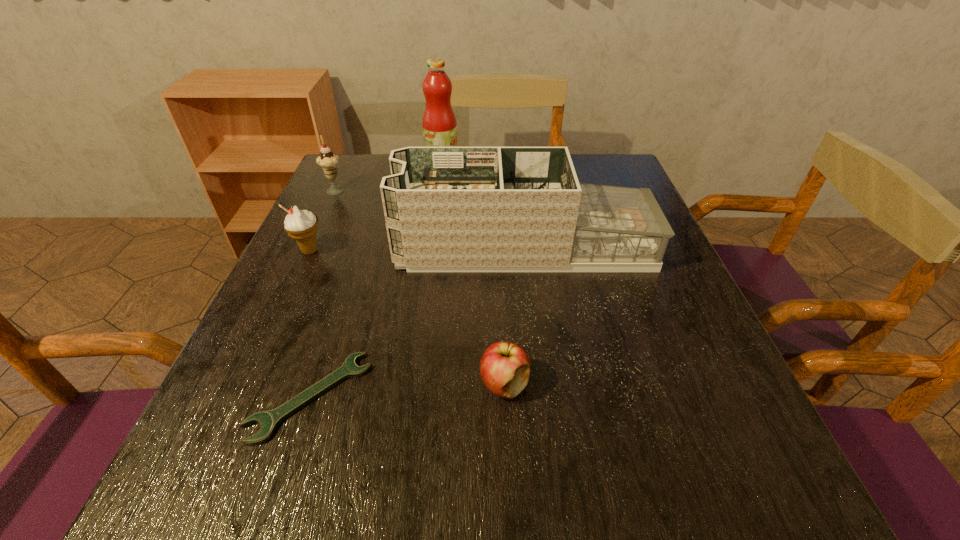
Find the location of `the farthest object`. the farthest object is located at coordinates (439, 123).

Locate an element on the screen. Image resolution: width=960 pixels, height=540 pixels. the tallest object is located at coordinates (439, 123).

Locate an element on the screen. the second tallest object is located at coordinates (447, 209).

Locate an element on the screen. This screenshot has width=960, height=540. the second farthest object is located at coordinates (327, 160).

What are the coordinates of `the farther icecream` in the screenshot? It's located at (327, 160).

At what (x,y) coordinates should I click in order to perform the action: click on the shorter icecream. Please return your answer as a coordinate pair (x, y). Image resolution: width=960 pixels, height=540 pixels. Looking at the image, I should click on (301, 225).

Image resolution: width=960 pixels, height=540 pixels. Find the location of `the third shortest object`. the third shortest object is located at coordinates (301, 225).

Identify the location of apple. (504, 367).

At what (x,y) coordinates should I click in order to perform the action: click on the shortest object. Please return your answer as a coordinate pair (x, y). This screenshot has height=540, width=960. Looking at the image, I should click on (269, 420).

Where is `free region located 0.170m on the front label of the farthest object`? free region located 0.170m on the front label of the farthest object is located at coordinates (517, 167).